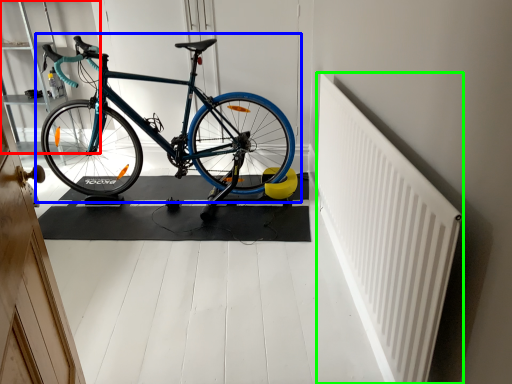
Question: Which object is positioned closest to shelf (highlighted by a red box)? Select from bicycle (highlighted by a blue box) and radiator (highlighted by a green box).

Choices:
 (A) bicycle
 (B) radiator

Answer: (A)